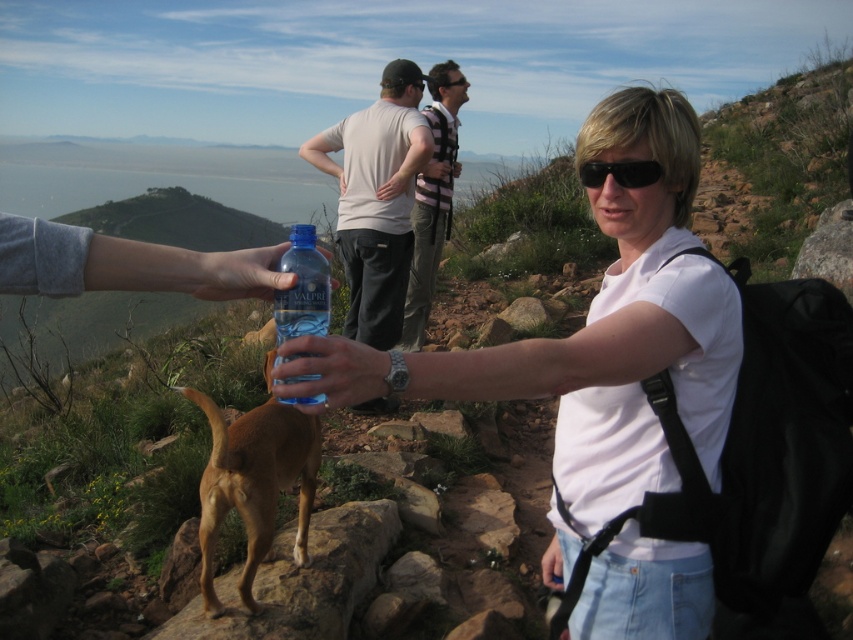
You are a hiker trying to locate your friend wearing a white matte shirt at center. According to the image, where exactly is your friend positioned in relation to the rocky terrain and the other hikers?

The white matte shirt at center is located at point 0.528 on the horizontal axis and 0.699 on the vertical axis, placing it centrally within the image frame. This position likely places your friend in the foreground near the rocky terrain, between the woman offering water and the small dog, while the two men in the background are further back on the path.

You are a hiker who just finished a strenuous hike and need to hydrate. You see the brown furry dog at lower left and the blue plastic bottle at center. Which object is positioned lower in the image?

The brown furry dog at lower left is located below the blue plastic bottle at center, so it is positioned lower in the image.